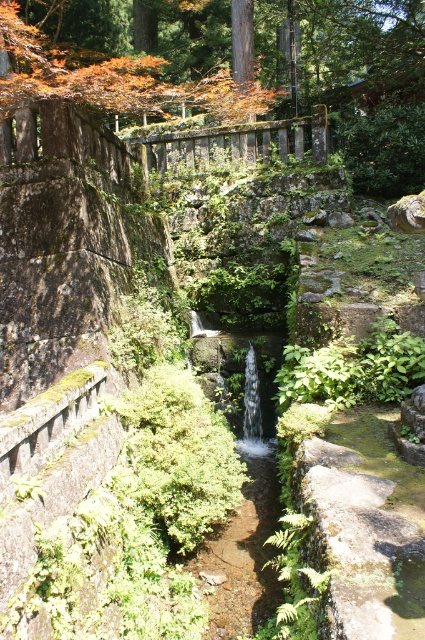
Is rustic stone balustrade at upper center to the left of silver metallic waterfall at center from the viewer's perspective?

Yes, rustic stone balustrade at upper center is to the left of silver metallic waterfall at center.

Which is more to the right, rustic stone balustrade at upper center or silver metallic waterfall at center?

From the viewer's perspective, silver metallic waterfall at center appears more on the right side.

Is point (255, 141) farther from viewer compared to point (251, 422)?

Yes, point (255, 141) is behind point (251, 422).

Image resolution: width=425 pixels, height=640 pixels. I want to click on rustic stone balustrade at upper center, so click(x=235, y=141).

Which of these two, orange leafy tree at upper left or rustic stone balustrade at upper center, stands taller?

With more height is orange leafy tree at upper left.

Is orange leafy tree at upper left wider than rustic stone balustrade at upper center?

Indeed, orange leafy tree at upper left has a greater width compared to rustic stone balustrade at upper center.

This screenshot has height=640, width=425. Find the location of `orange leafy tree at upper left`. orange leafy tree at upper left is located at coordinates (367, 84).

The width and height of the screenshot is (425, 640). What are the coordinates of `orange leafy tree at upper left` in the screenshot? It's located at (367, 84).

Measure the distance from orange leafy tree at upper left to silver metallic waterfall at center.

9.06 meters

Does orange leafy tree at upper left appear on the right side of silver metallic waterfall at center?

Incorrect, orange leafy tree at upper left is not on the right side of silver metallic waterfall at center.

Image resolution: width=425 pixels, height=640 pixels. What are the coordinates of `orange leafy tree at upper left` in the screenshot? It's located at (367, 84).